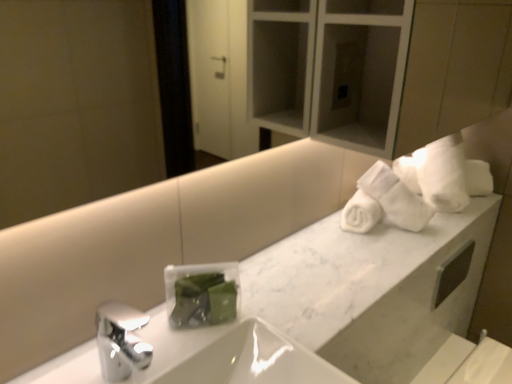
Question: Based on their positions, is white glossy sink at center located to the left or right of white marble counter at upper right?

Choices:
 (A) right
 (B) left

Answer: (B)

Question: Considering their positions, is white glossy sink at center located in front of or behind white marble counter at upper right?

Choices:
 (A) behind
 (B) front

Answer: (B)

Question: Which object is positioned farthest from the white soft towels at upper right?

Choices:
 (A) white marble counter at upper right
 (B) white glossy sink at center

Answer: (B)

Question: Considering the real-world distances, which object is farthest from the white marble counter at upper right?

Choices:
 (A) white glossy sink at center
 (B) white soft towels at upper right

Answer: (A)